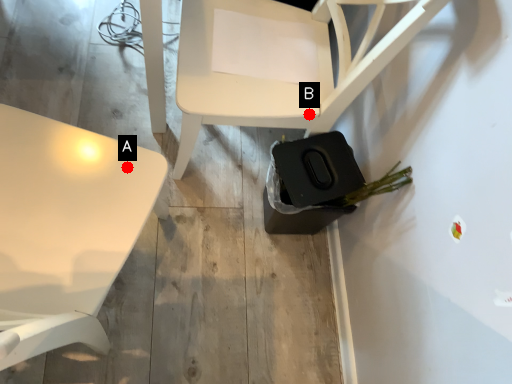
Question: Two points are circled on the image, labeled by A and B beside each circle. Among these points, which one is farthest from the camera?

Choices:
 (A) A is further
 (B) B is further

Answer: (B)